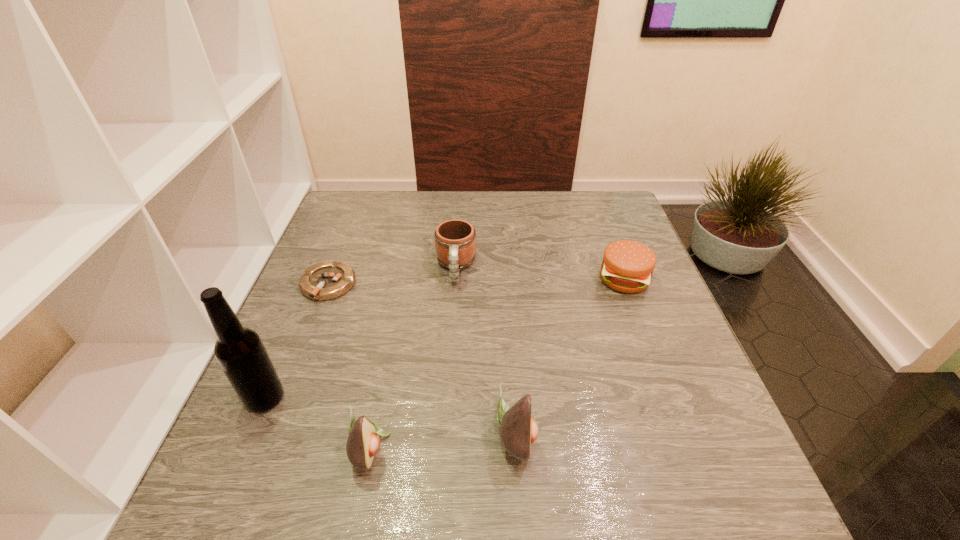
At what (x,y) coordinates should I click in order to perform the action: click on vacant region at the left edge of the desktop. Please return your answer as a coordinate pair (x, y). The height and width of the screenshot is (540, 960). Looking at the image, I should click on (351, 327).

Identify the location of vacant space at the right edge of the desktop. Image resolution: width=960 pixels, height=540 pixels. (634, 313).

The image size is (960, 540). In order to click on vacant space at the far left corner in this screenshot , I will do `click(351, 213)`.

In the image, there is a desktop. What are the coordinates of `free region at the far right corner` in the screenshot? It's located at (616, 231).

The width and height of the screenshot is (960, 540). Identify the location of blank region between the mug and the beer bottle. (361, 333).

Locate an element on the screen. The height and width of the screenshot is (540, 960). free space between the shorter avocado and the mug is located at coordinates (413, 357).

Where is `vacant space that's between the tallest object and the hamburger`? This screenshot has height=540, width=960. vacant space that's between the tallest object and the hamburger is located at coordinates (444, 339).

I want to click on free space between the shortest object and the beer bottle, so click(x=297, y=342).

Locate an element on the screen. This screenshot has height=540, width=960. vacant space that is in between the tallest object and the fourth shortest object is located at coordinates (318, 423).

At what (x,y) coordinates should I click in order to perform the action: click on vacant region between the mug and the shortest object. Please return your answer as a coordinate pair (x, y). The width and height of the screenshot is (960, 540). Looking at the image, I should click on (392, 276).